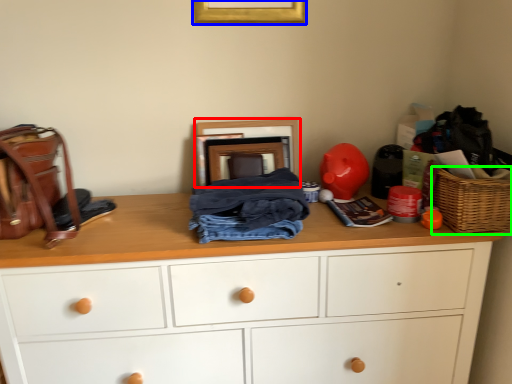
Question: Estimate the real-world distances between objects in this image. Which object is closer to picture frame (highlighted by a red box), picture frame (highlighted by a blue box) or picnic basket (highlighted by a green box)?

Choices:
 (A) picture frame
 (B) picnic basket

Answer: (A)